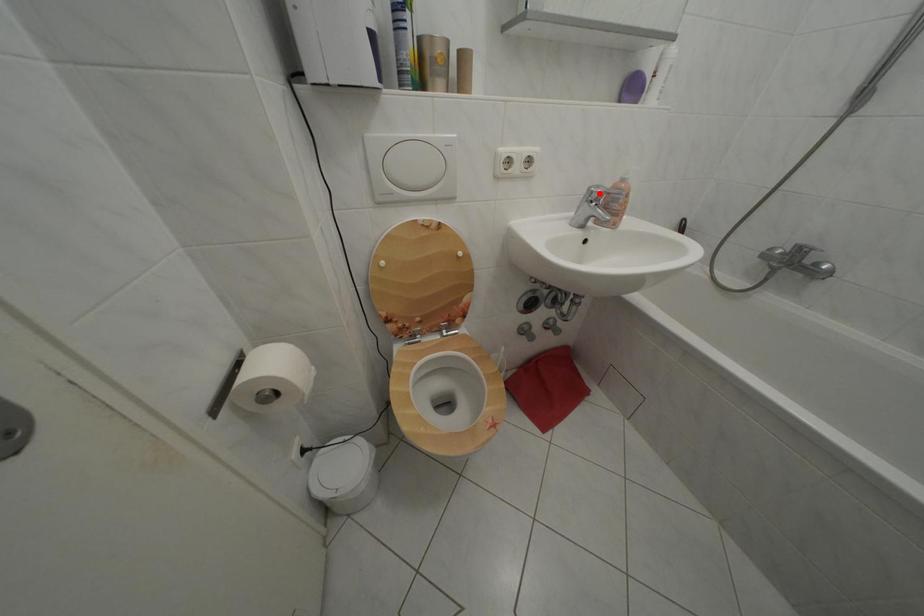
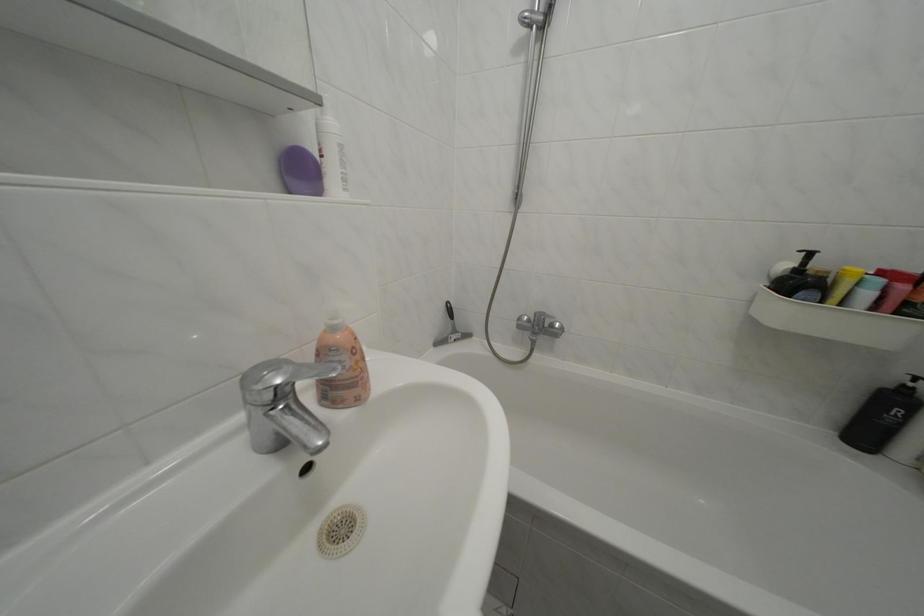
Question: I am providing you with two images of the same scene from different viewpoints. Given a red point in image1, look at the same physical point in image2. Is it:

Choices:
 (A) Closer to the viewpoint
 (B) Farther from the viewpoint

Answer: (B)